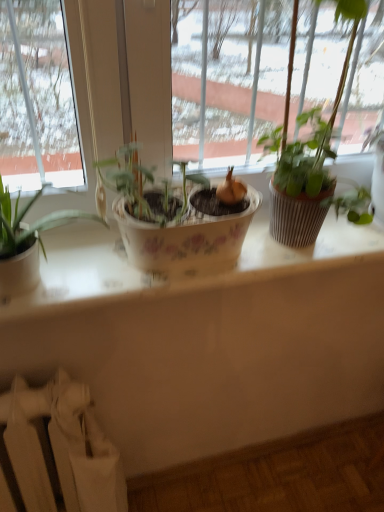
You are a GUI agent. You are given a task and a screenshot of the screen. Output one action in this format:
    pyautogui.click(x=<x>, y=<y>)
    Task: Click on the free region under green matte plant at upper right (from a real-world perspective)
    The width and height of the screenshot is (384, 512).
    Given the screenshot: What is the action you would take?
    pyautogui.click(x=301, y=250)